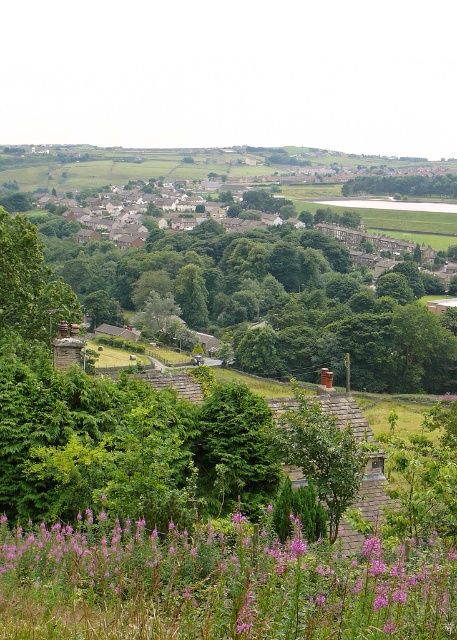
You are standing at the top of a slope overlooking a rural landscape. You see a point marked at coordinates [217,584]. What is located at that point?

The point at coordinates [217,584] indicates purple soft textured flowers at lower center.

You are standing at the highest point of the slope in the foreground of the rural landscape. You notice two points marked in the image. Which point, point [287,612] or point [361,182], is closer to your current position?

Point [287,612] is closer to the camera than point [361,182], so it is closer to your current position.